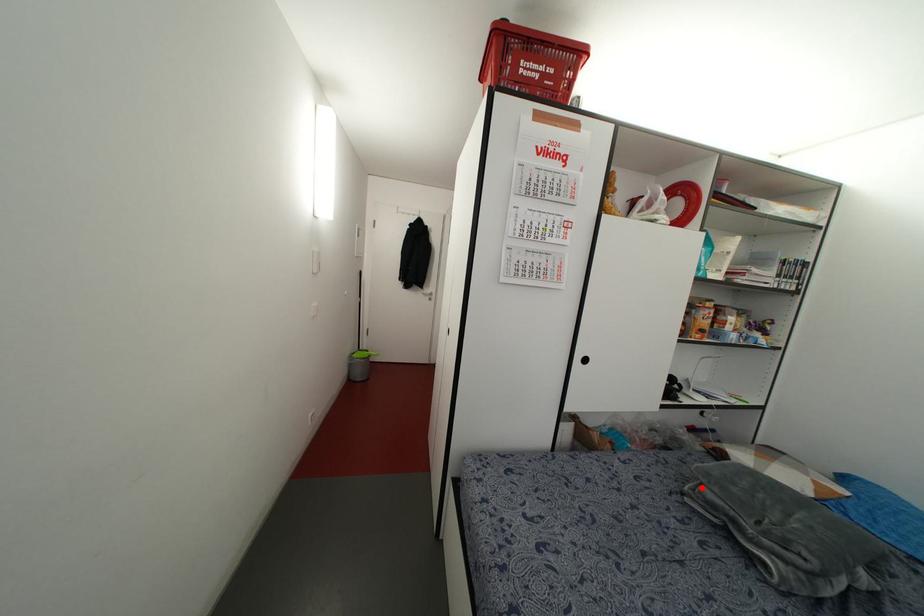
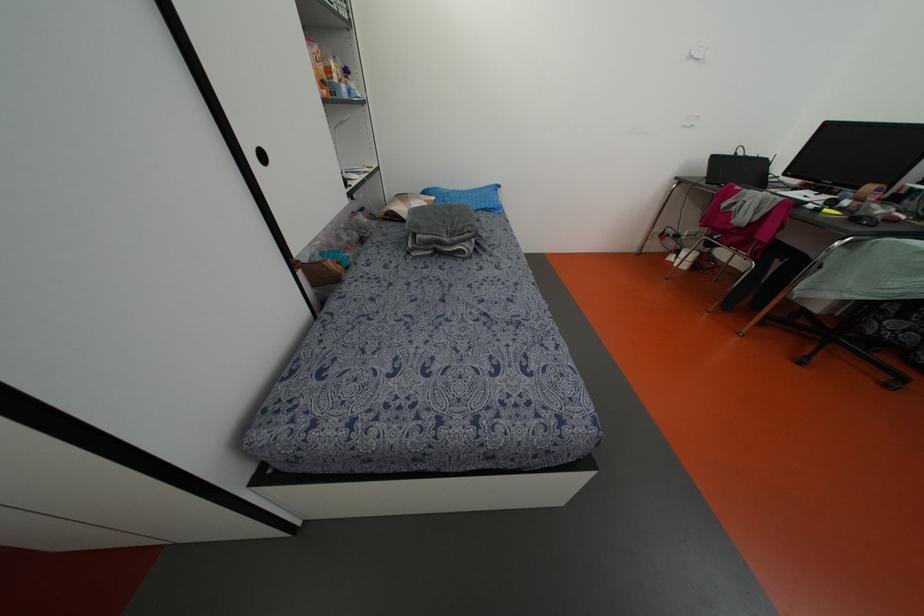
Where in the second image is the point corresponding to the highlighted location from the first image?

(418, 236)